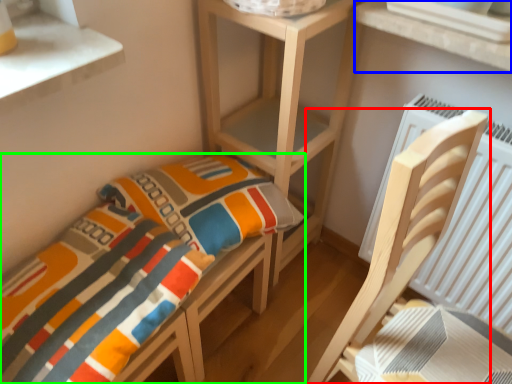
Question: Which object is the farthest from furniture (highlighted by a red box)? Choose among these: window (highlighted by a blue box) or furniture (highlighted by a green box).

Choices:
 (A) window
 (B) furniture

Answer: (B)